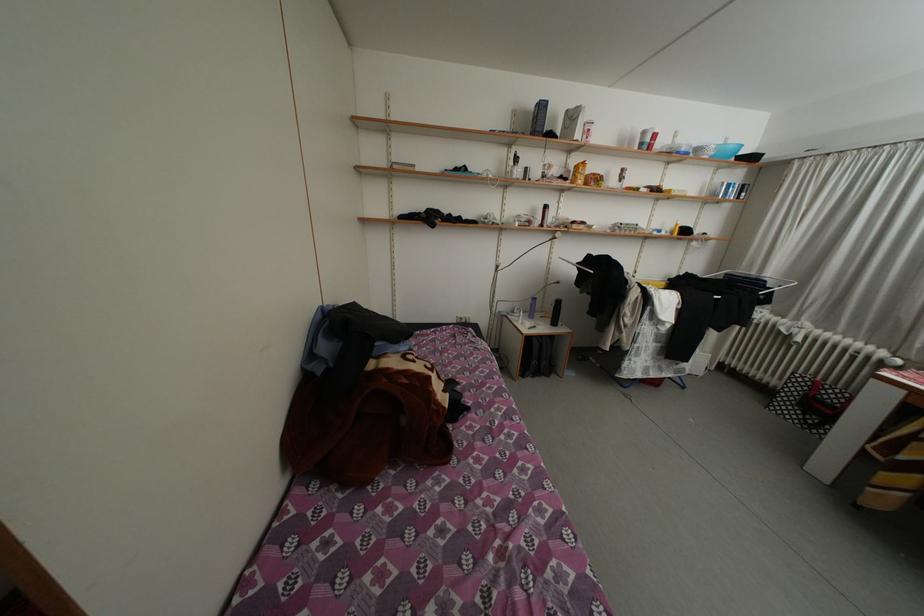
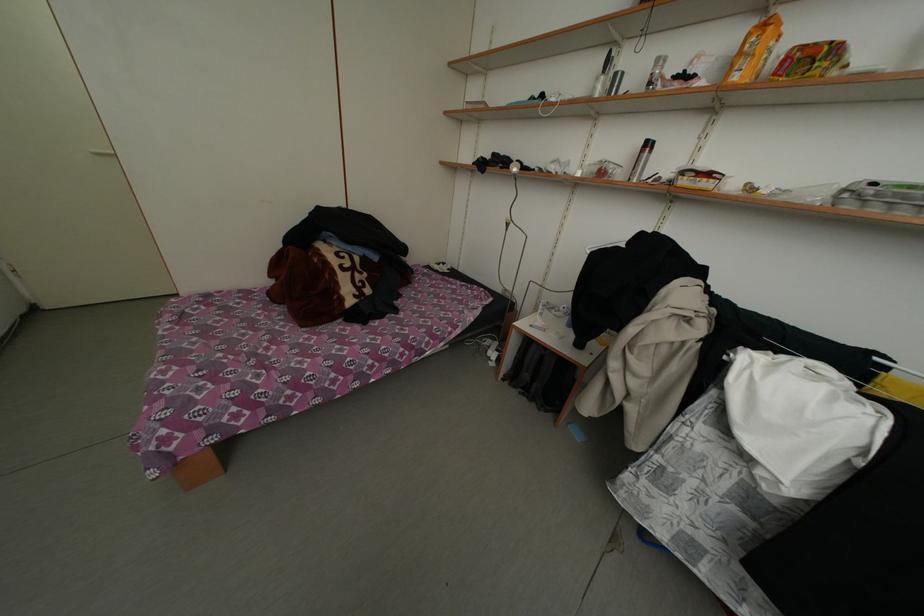
In the second image, find the point that corresponds to [519,177] in the first image.

(602, 94)